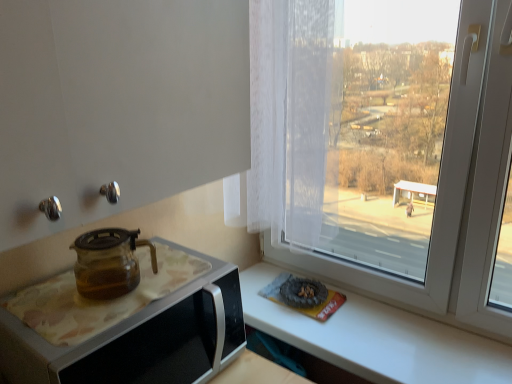
You are a GUI agent. You are given a task and a screenshot of the screen. Output one action in this format:
    pyautogui.click(x=<x>, y=<y>)
    Task: Click on the vacant region in front of transparent glass teapot at left
    
    Given the screenshot: What is the action you would take?
    pyautogui.click(x=93, y=335)